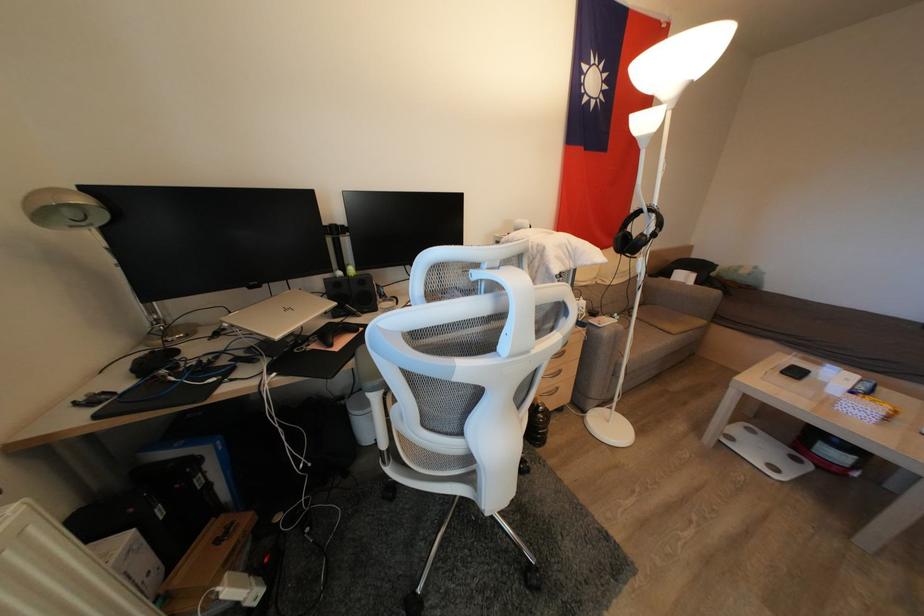
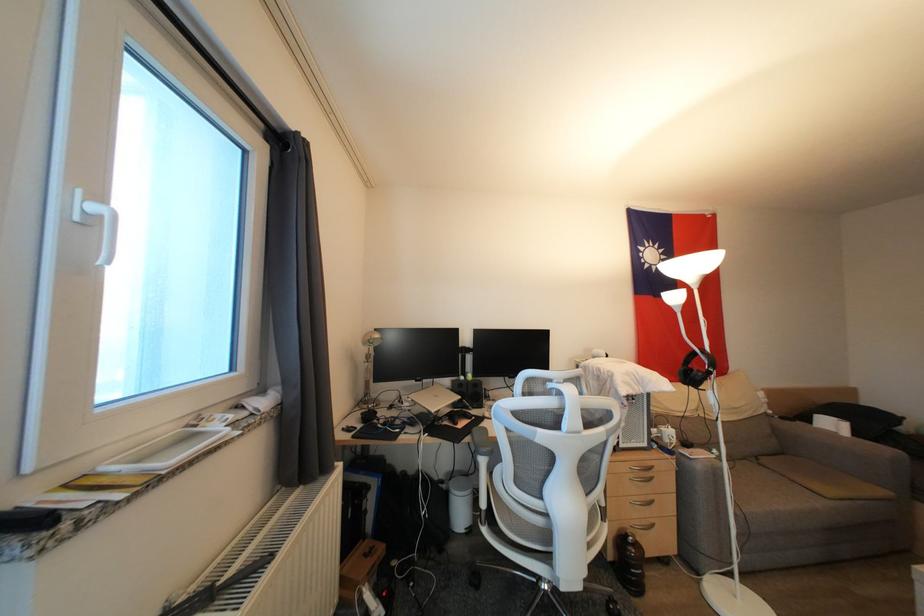
The point at (707,326) is marked in the first image. Where is the corresponding point in the second image?

(889, 496)